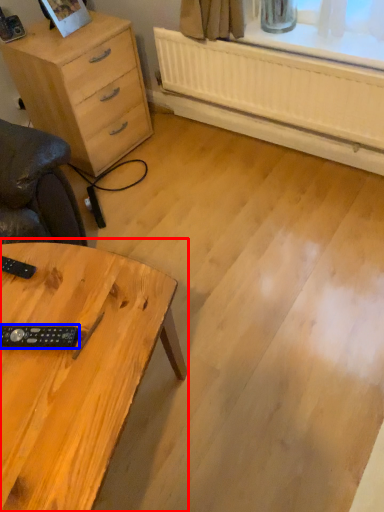
Question: Which point is further to the camera, table (highlighted by a red box) or control (highlighted by a blue box)?

Choices:
 (A) table
 (B) control

Answer: (B)